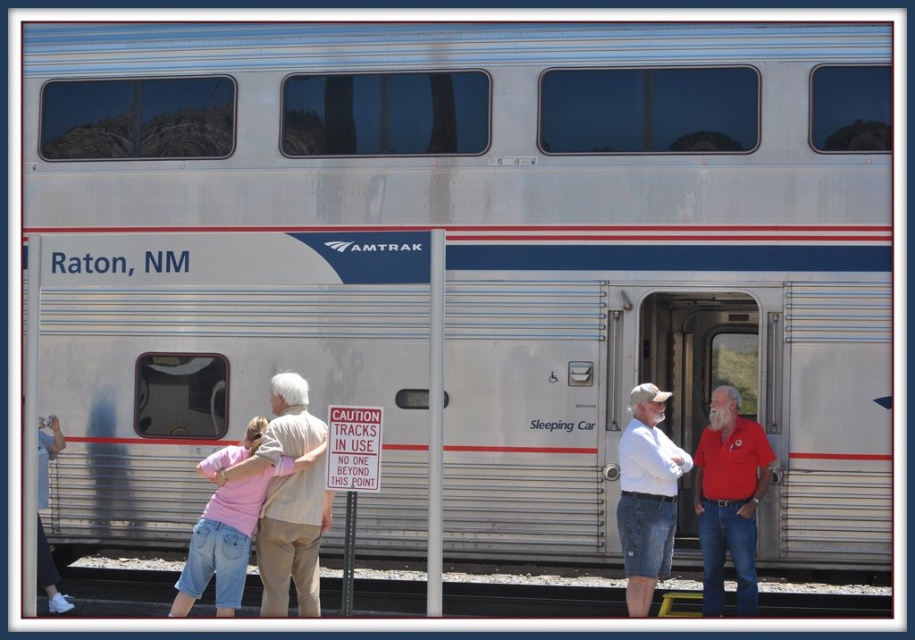
Consider the image. You are a photographer standing at the train station. You want to take a photo of the red cotton shirt at right and denim shorts at center. Which object should you zoom in on to capture both in the frame without moving the camera?

The red cotton shirt at right is bigger than denim shorts at center, so you should zoom in on the denim shorts at center to ensure both fit in the frame.

Consider the image. You are standing at the train station and want to reach a specific point marked at coordinates point (737, 570). If your walking speed is 1.5 meters per second, how long will it take you to reach that point?

The distance of point (737, 570) from viewer is 10.12 meters. At a walking speed of 1.5 meters per second, it will take approximately 6.75 seconds to reach the point.

You are standing at the train station in front of the Amtrak train car labeled Raton, NM. You notice a specific location marked by the coordinates point (531,596). What is located at that point?

The point (531,596) marks gray gravel at lower center.